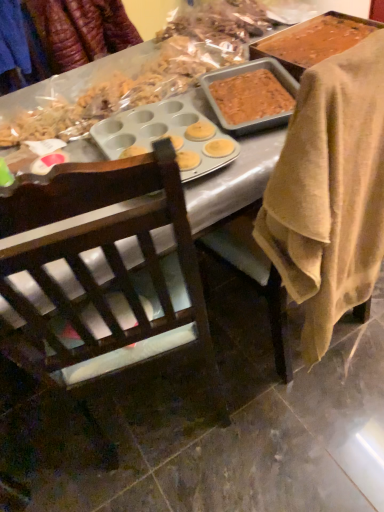
Question: From a real-world perspective, is dark wood chair at center, arranged as the first chair when viewed from the left, above or below brown wooden chair at center, which is counted as the second chair, starting from the left?

Choices:
 (A) below
 (B) above

Answer: (A)

Question: From the image's perspective, relative to brown wooden chair at center, marked as the first chair in a right-to-left arrangement, is dark wood chair at center, which is counted as the 2th chair, starting from the right, above or below?

Choices:
 (A) above
 (B) below

Answer: (B)

Question: Estimate the real-world distances between objects in this image. Which object is closer to the dark wood chair at center, arranged as the first chair when viewed from the left?

Choices:
 (A) blue fabric at upper left
 (B) brown wooden chair at center, marked as the first chair in a right-to-left arrangement

Answer: (B)

Question: Considering the real-world distances, which object is closest to the brown wooden chair at center, marked as the first chair in a right-to-left arrangement?

Choices:
 (A) dark wood chair at center, arranged as the first chair when viewed from the left
 (B) blue fabric at upper left

Answer: (A)